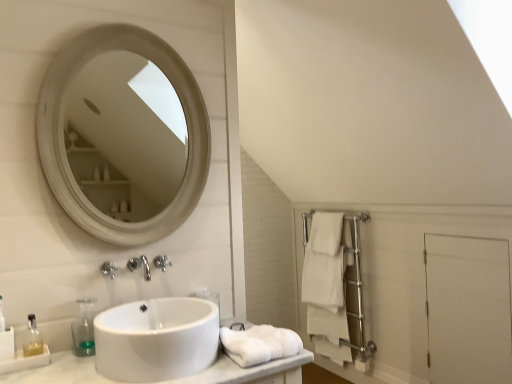
Question: Does point (198, 354) appear closer or farther from the camera than point (34, 344)?

Choices:
 (A) closer
 (B) farther

Answer: (A)

Question: Which is correct: white glossy sink at center is inside translucent plastic soap dispenser at lower left, which appears as the 1th soap dispenser when viewed from the left, or outside of it?

Choices:
 (A) outside
 (B) inside

Answer: (A)

Question: Based on their relative distances, which object is farther from the white glossy sink at center?

Choices:
 (A) transparent plastic soap dispenser at lower left, the second soap dispenser when ordered from left to right
 (B) white cotton towel at right, which is the first bath towel in bottom-to-top order
 (C) silver metallic faucet at lower center, the first faucet in the right-to-left sequence
 (D) white matte screen door at right
 (E) satin nickel faucet at center, which ranks as the 2th faucet in right-to-left order

Answer: (B)

Question: Estimate the real-world distances between objects in this image. Which object is farther from the white cotton towel at right, the first bath towel from the right?

Choices:
 (A) transparent plastic soap dispenser at lower left, positioned as the first soap dispenser in right-to-left order
 (B) white matte screen door at right
 (C) translucent glass soap dispenser at lower left
 (D) translucent plastic soap dispenser at lower left, the second soap dispenser when ordered from right to left
 (E) silver metallic faucet at lower center, the first faucet in the right-to-left sequence

Answer: (C)